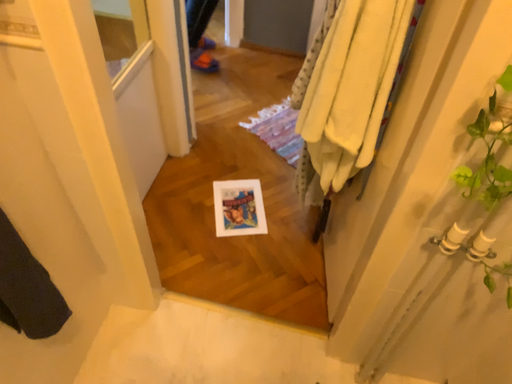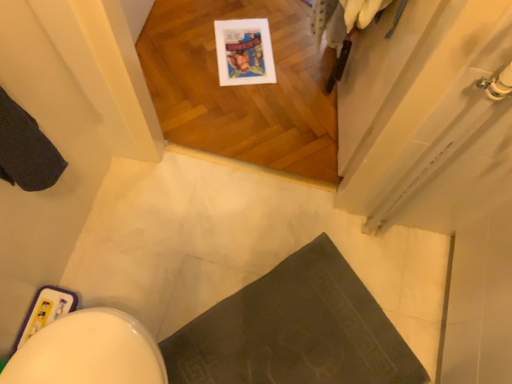
Question: How did the camera likely rotate when shooting the video?

Choices:
 (A) rotated downward
 (B) rotated upward

Answer: (A)